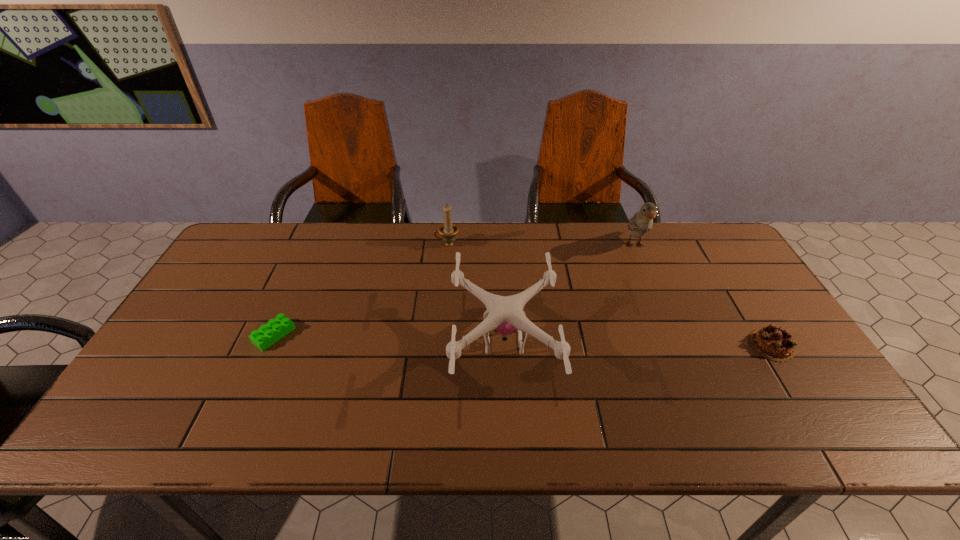
The width and height of the screenshot is (960, 540). I want to click on vacant area that satisfies the following two spatial constraints: 1. at the face of the second shortest object; 2. on the left side of the fourth object from left to right, so click(x=677, y=345).

What are the coordinates of `vacant space that satisfies the following two spatial constraints: 1. at the face of the rightmost object; 2. on the right side of the bird` in the screenshot? It's located at (677, 345).

This screenshot has height=540, width=960. I want to click on free space that satisfies the following two spatial constraints: 1. on the handle side of the candle_holder; 2. on the left side of the fourth tallest object, so click(438, 345).

The width and height of the screenshot is (960, 540). I want to click on free spot that satisfies the following two spatial constraints: 1. on the top of the drone; 2. on the back side of the rightmost object, so click(504, 345).